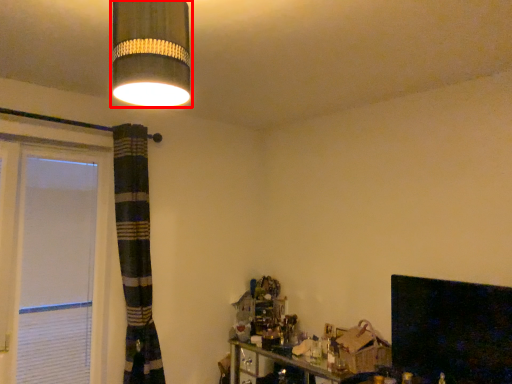
Question: From the image's perspective, where is lamp (annotated by the red box) located in relation to fireplace in the image?

Choices:
 (A) above
 (B) below

Answer: (A)